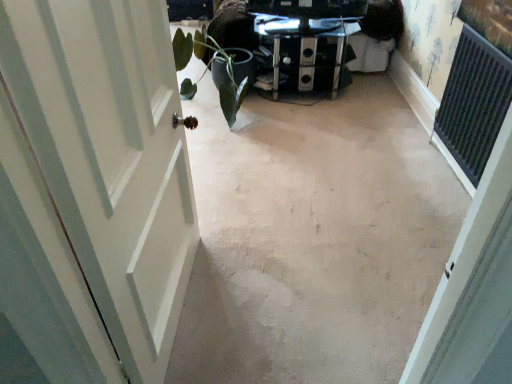
Question: From their relative heights in the image, would you say metallic glass table at center is taller or shorter than green matte plant at left?

Choices:
 (A) short
 (B) tall

Answer: (A)

Question: From the image's perspective, is metallic glass table at center positioned above or below green matte plant at left?

Choices:
 (A) below
 (B) above

Answer: (B)

Question: Considering the real-world distances, which object is closest to the metallic glass table at center?

Choices:
 (A) beige carpet at center
 (B) green matte plant at left
 (C) white painted wood door at left

Answer: (B)

Question: Based on their relative distances, which object is farther from the beige carpet at center?

Choices:
 (A) metallic glass table at center
 (B) green matte plant at left
 (C) white painted wood door at left

Answer: (A)